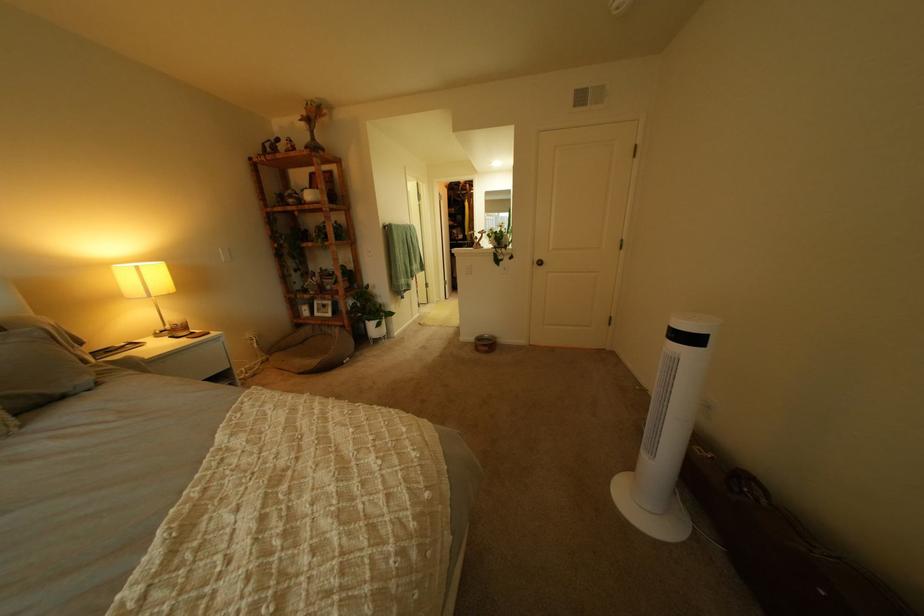
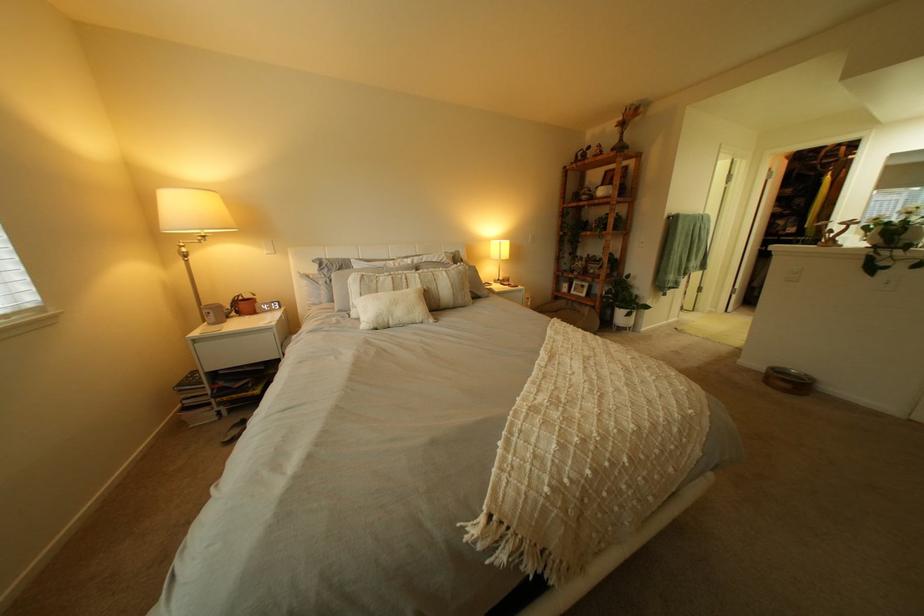
Find the pixel in the second image that matches [381,318] in the first image.

(633, 305)